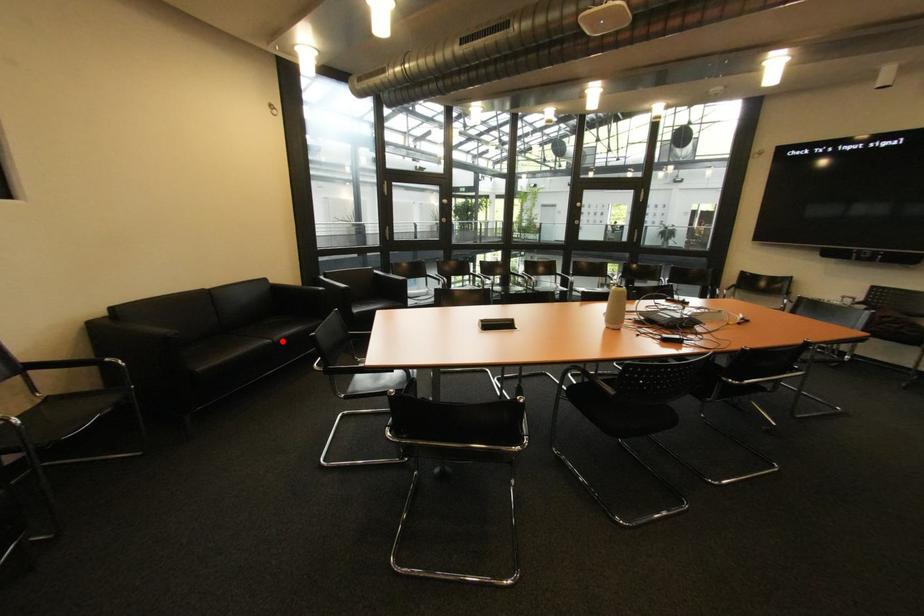
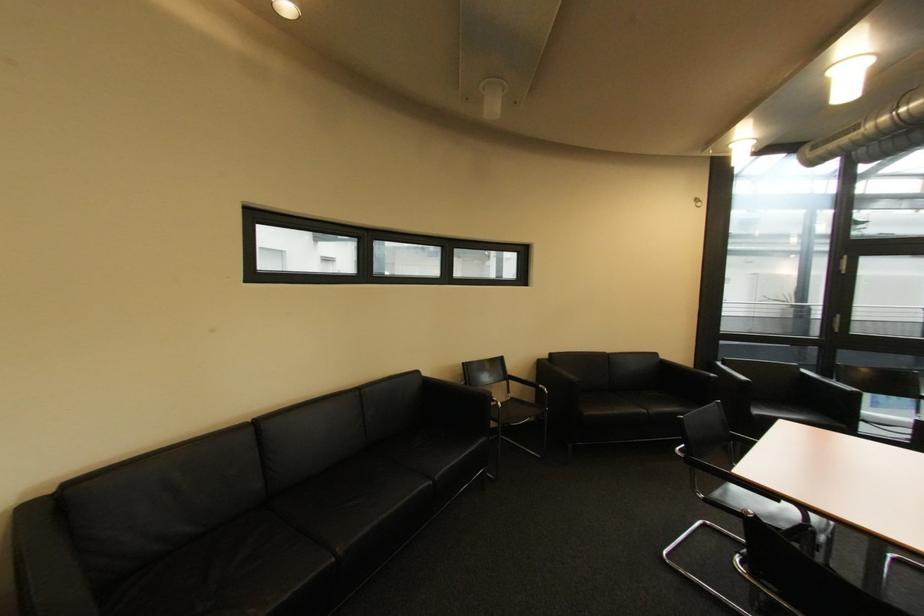
Question: A red point is marked in image1. In image2, is the corresponding 3D point closer to the camera or farther? Reply with the corresponding letter.

Choices:
 (A) The corresponding 3D point is closer.
 (B) The corresponding 3D point is farther.

Answer: (A)